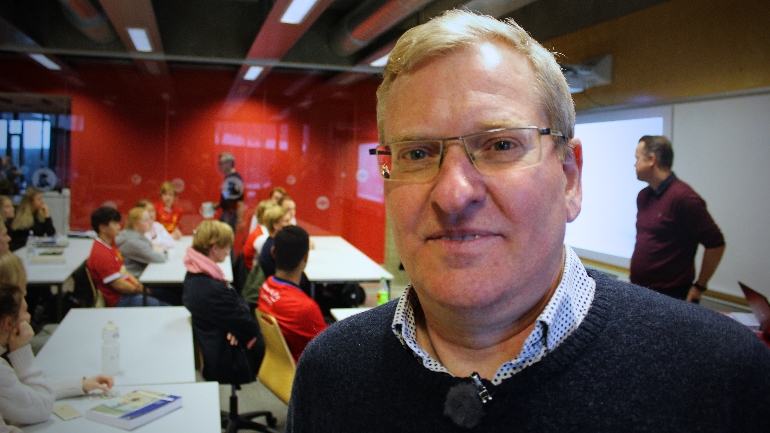
Where is `classroom tables`? The height and width of the screenshot is (433, 770). classroom tables is located at coordinates (39, 277), (78, 249), (159, 270), (346, 266), (335, 242), (155, 338), (65, 352), (155, 372), (188, 416).